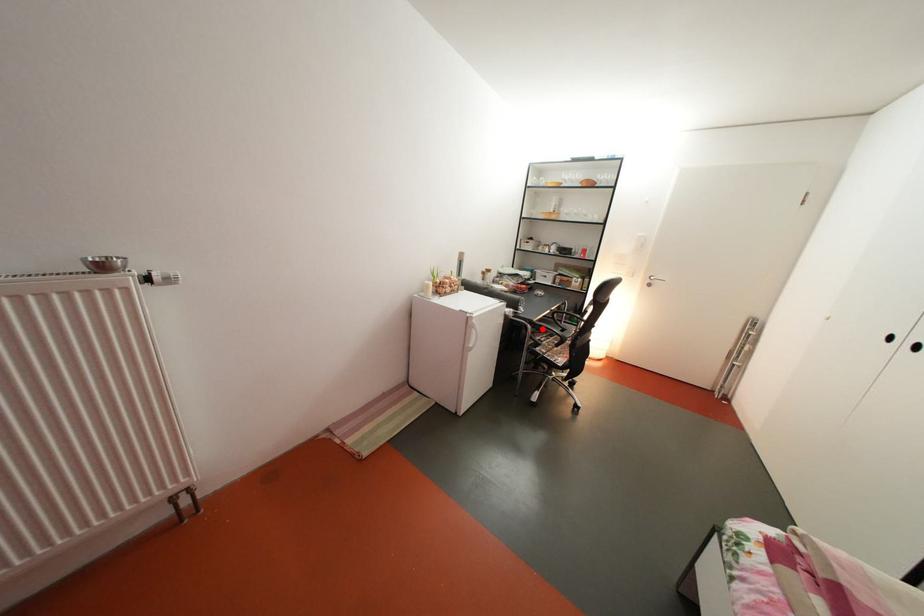
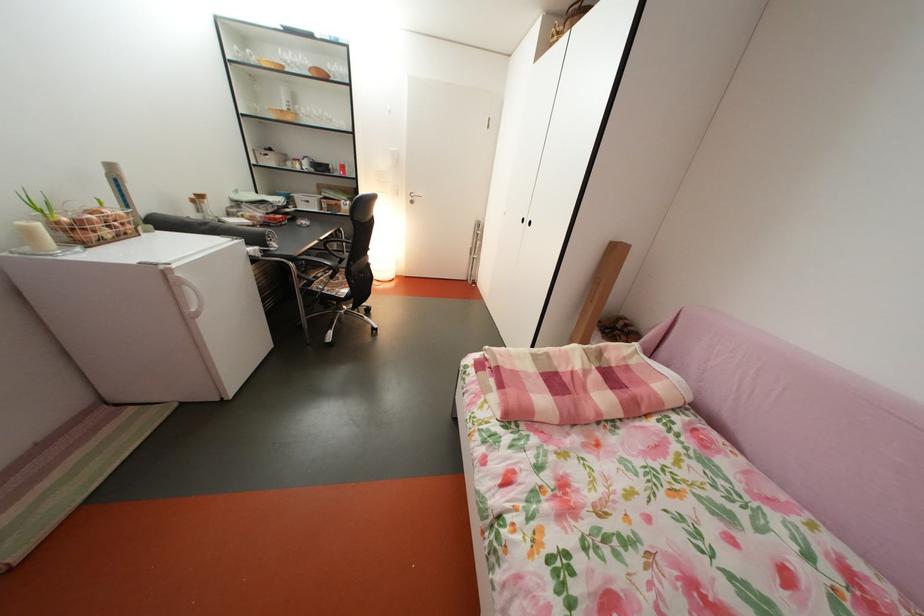
Where in the second image is the point corresponding to the highlighted location from the first image?

(304, 265)